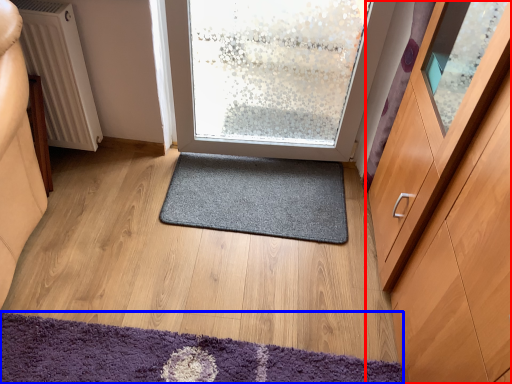
Question: Which object is further to the camera taking this photo, cabinetry (highlighted by a red box) or mat (highlighted by a blue box)?

Choices:
 (A) cabinetry
 (B) mat

Answer: (B)